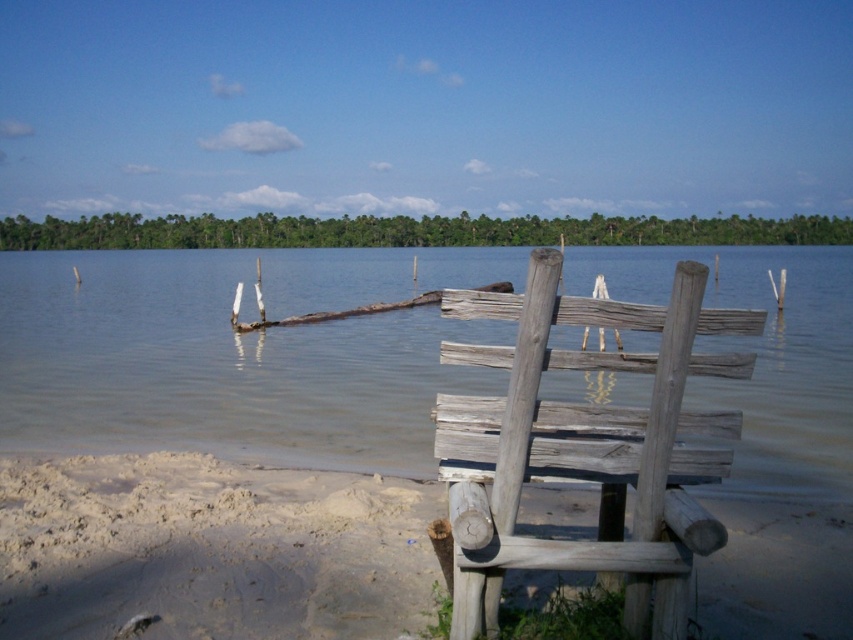
Which is above, clear water at chair right or light brown sandy beach at lower left?

clear water at chair right is higher up.

Is clear water at chair right closer to the viewer compared to light brown sandy beach at lower left?

Yes, it is in front of light brown sandy beach at lower left.

Is point (808, 310) more distant than point (236, 506)?

Yes, point (808, 310) is farther from viewer.

You are a GUI agent. You are given a task and a screenshot of the screen. Output one action in this format:
    pyautogui.click(x=<x>, y=<y>)
    Task: Click on the clear water at chair right
    The image size is (853, 640).
    Given the screenshot: What is the action you would take?
    pyautogui.click(x=213, y=365)

The height and width of the screenshot is (640, 853). What do you see at coordinates (213, 365) in the screenshot?
I see `clear water at chair right` at bounding box center [213, 365].

Who is more forward, [351,449] or [491,300]?

Point [491,300] is more forward.

You are a GUI agent. You are given a task and a screenshot of the screen. Output one action in this format:
    pyautogui.click(x=<x>, y=<y>)
    Task: Click on the clear water at chair right
    
    Given the screenshot: What is the action you would take?
    pyautogui.click(x=213, y=365)

Does light brown sandy beach at lower left lie in front of weathered wood chair at center?

No, it is behind weathered wood chair at center.

Identify the location of light brown sandy beach at lower left. The width and height of the screenshot is (853, 640). (210, 548).

Measure the distance between point [338,477] and camera.

23.75 feet

At what (x,y) coordinates should I click in order to perform the action: click on light brown sandy beach at lower left. Please return your answer as a coordinate pair (x, y). This screenshot has width=853, height=640. Looking at the image, I should click on (210, 548).